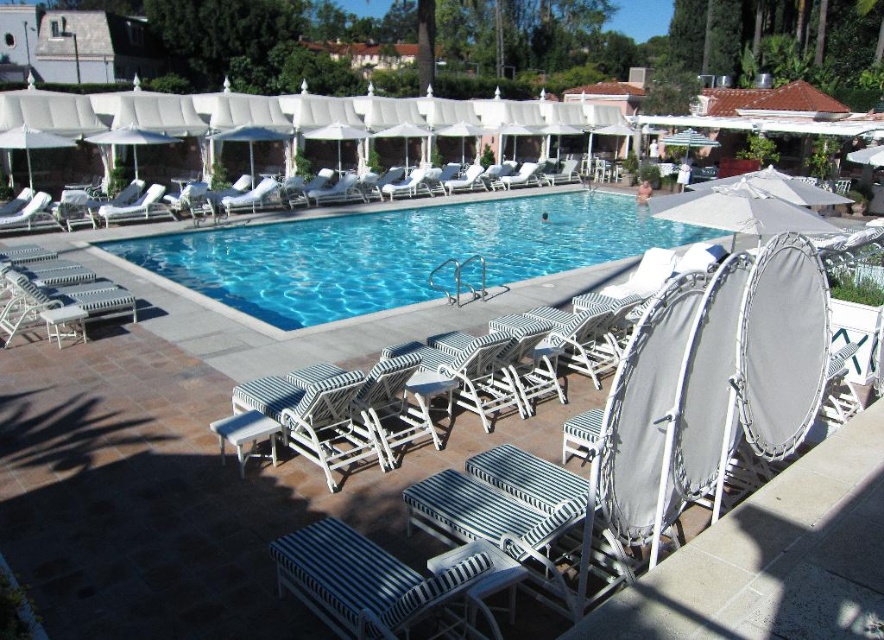
Question: Which object is the farthest from the white fabric umbrella at upper left?

Choices:
 (A) blue glossy pool at center
 (B) white fabric umbrella at upper right
 (C) white fabric umbrella at upper center

Answer: (B)

Question: Does blue glossy pool at center appear under white fabric umbrella at upper center?

Choices:
 (A) no
 (B) yes

Answer: (A)

Question: Where is striped fabric lounge chair at center located in relation to white fabric umbrella at upper right in the image?

Choices:
 (A) below
 (B) above

Answer: (A)

Question: Estimate the real-world distances between objects in this image. Which object is closer to the blue glossy pool at center?

Choices:
 (A) white fabric umbrella at upper center
 (B) white fabric umbrella at upper right
 (C) striped fabric lounge chair at center

Answer: (B)

Question: Which is nearer to the blue glossy pool at center?

Choices:
 (A) white fabric umbrella at upper left
 (B) white fabric umbrella at upper center
 (C) striped fabric lounge chair at center
 (D) white fabric umbrella at upper right

Answer: (A)

Question: Observing the image, what is the correct spatial positioning of blue glossy pool at center in reference to striped fabric lounge chair at center?

Choices:
 (A) right
 (B) left

Answer: (A)